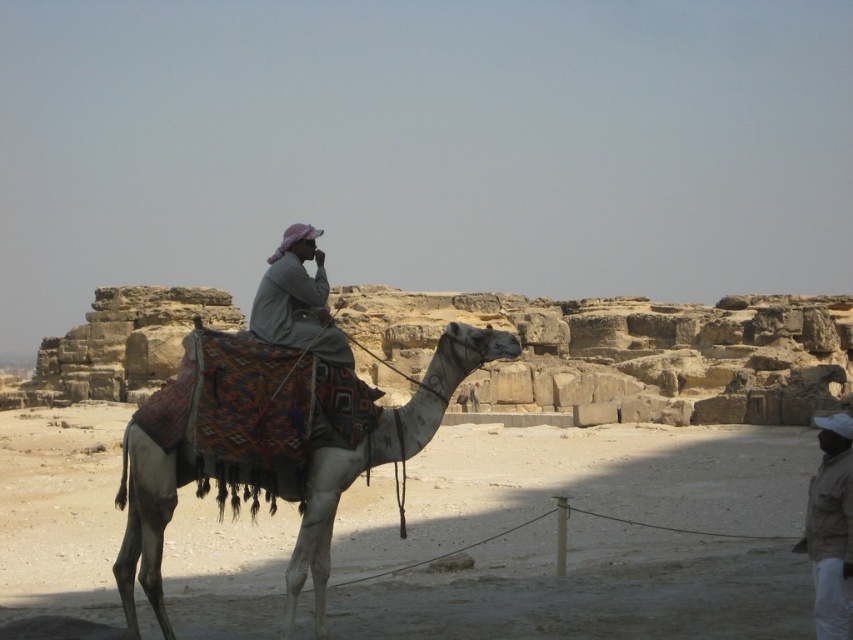
Between point (459, 348) and point (828, 460), which one is positioned behind?

Positioned behind is point (459, 348).

Which is in front, point (149, 410) or point (846, 433)?

Point (149, 410)

What do you see at coordinates (271, 444) in the screenshot?
I see `white textured camel at center` at bounding box center [271, 444].

Identify the location of white textured camel at center. (271, 444).

Is tan fabric jacket at lower right taller than light beige fabric at center?

Yes.

Locate an element on the screen. tan fabric jacket at lower right is located at coordinates (830, 525).

Can you confirm if white textured camel at center is wider than light beige fabric at center?

Yes.

Is white textured camel at center positioned behind light beige fabric at center?

No, it is not.

Locate an element on the screen. The image size is (853, 640). white textured camel at center is located at coordinates (271, 444).

Find the location of a particular element. white textured camel at center is located at coordinates (271, 444).